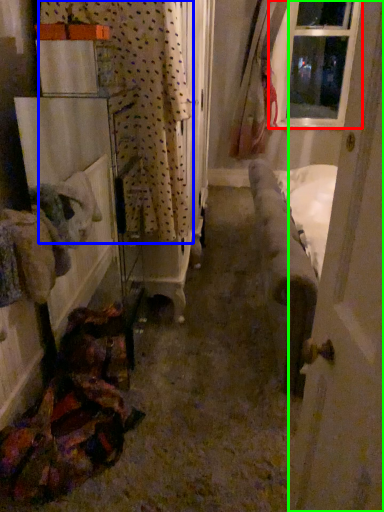
Question: Estimate the real-world distances between objects in this image. Which object is closer to window (highlighted by a red box), curtain (highlighted by a blue box) or door (highlighted by a green box)?

Choices:
 (A) curtain
 (B) door

Answer: (A)